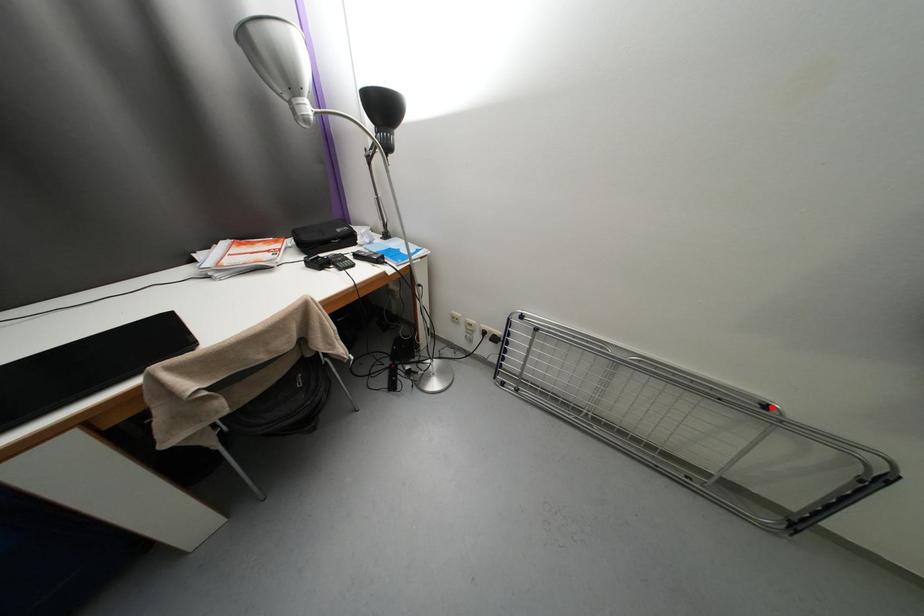
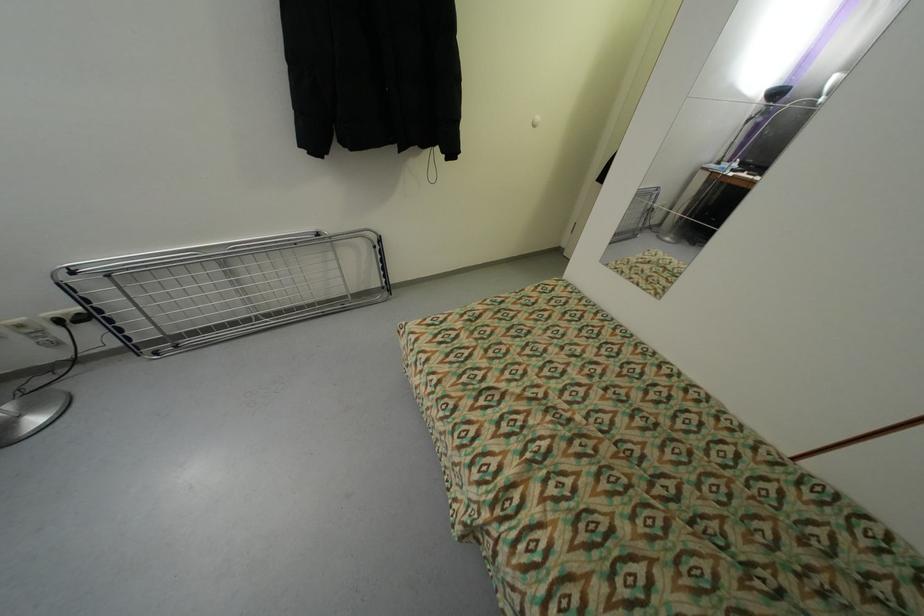
Locate, in the second image, the point that corresponds to the highlighted location in the first image.

(323, 236)